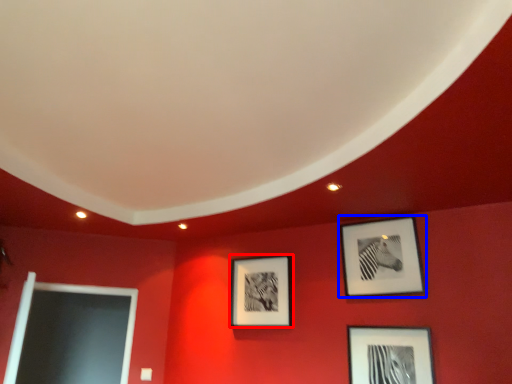
Question: Which of the following is the closest to the observer, picture frame (highlighted by a red box) or picture frame (highlighted by a blue box)?

Choices:
 (A) picture frame
 (B) picture frame

Answer: (B)